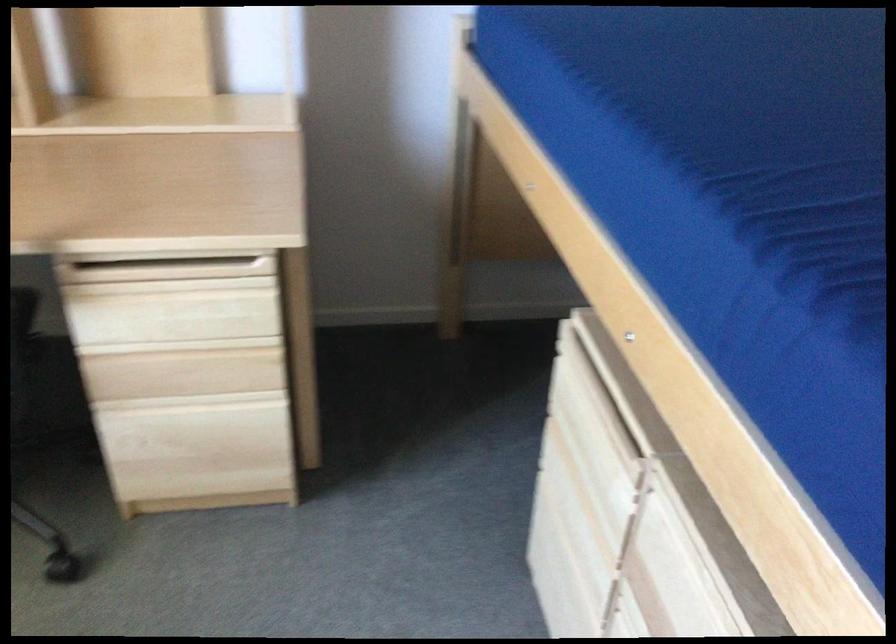
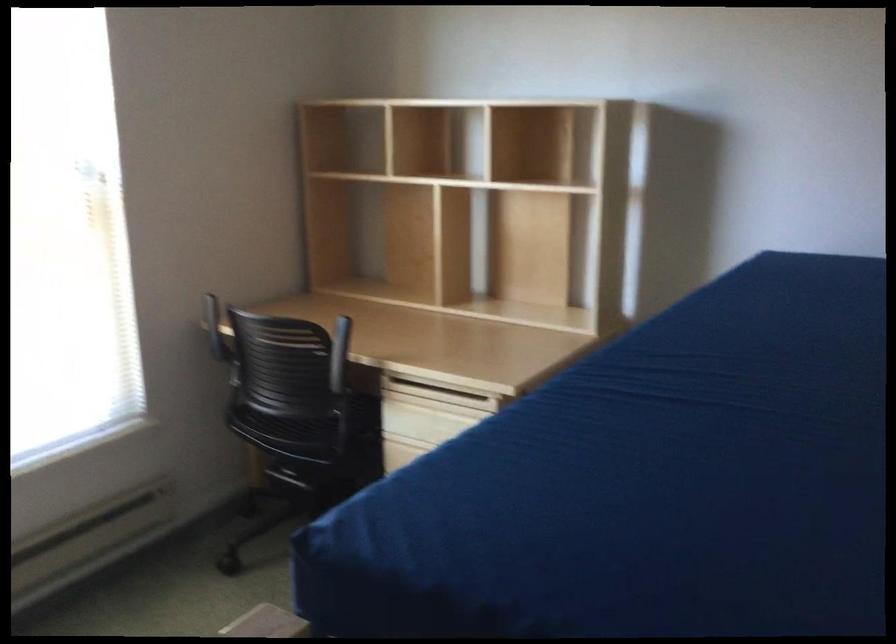
Question: The images are taken continuously from a first-person perspective. In which direction is your viewpoint rotating?

Choices:
 (A) Left
 (B) Right
 (C) Up
 (D) Down

Answer: (A)